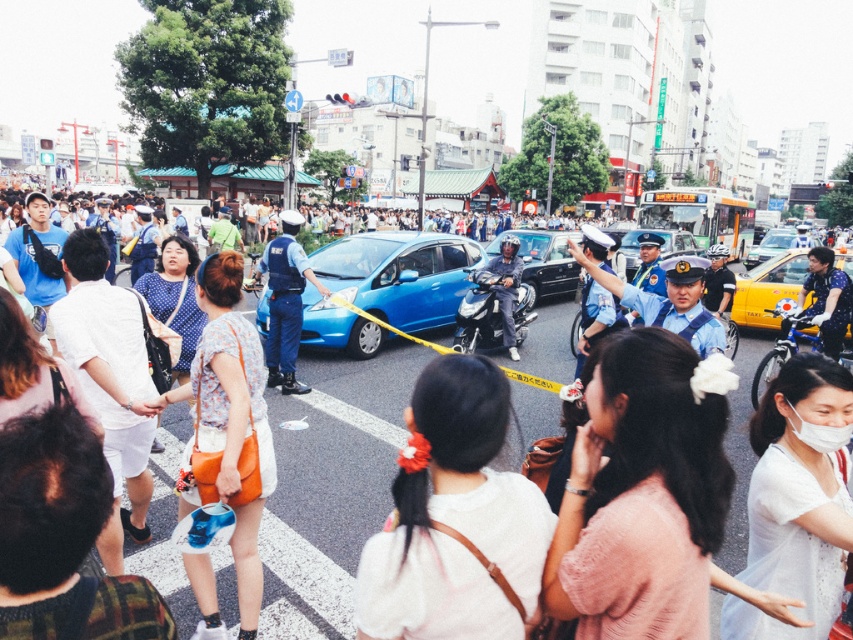
Question: Is shiny black motorcycle at center positioned in front of metallic silver cross at upper left?

Choices:
 (A) no
 (B) yes

Answer: (B)

Question: Estimate the real-world distances between objects in this image. Which object is closer to the floral fabric dress at center?

Choices:
 (A) blue matte car at center
 (B) white sheer blouse at lower right
 (C) yellow matte taxi at right

Answer: (B)

Question: Can you confirm if blue glossy car at center is positioned to the right of blue matte car at center?

Choices:
 (A) yes
 (B) no

Answer: (B)

Question: Can you confirm if white matte hair at center is thinner than shiny black motorcycle at center?

Choices:
 (A) yes
 (B) no

Answer: (A)

Question: Which point is closer to the camera?

Choices:
 (A) (795, 321)
 (B) (845, 298)
 (C) (785, 243)

Answer: (B)

Question: Which of the following is the farthest from the observer?

Choices:
 (A) (672, 228)
 (B) (827, 259)

Answer: (A)